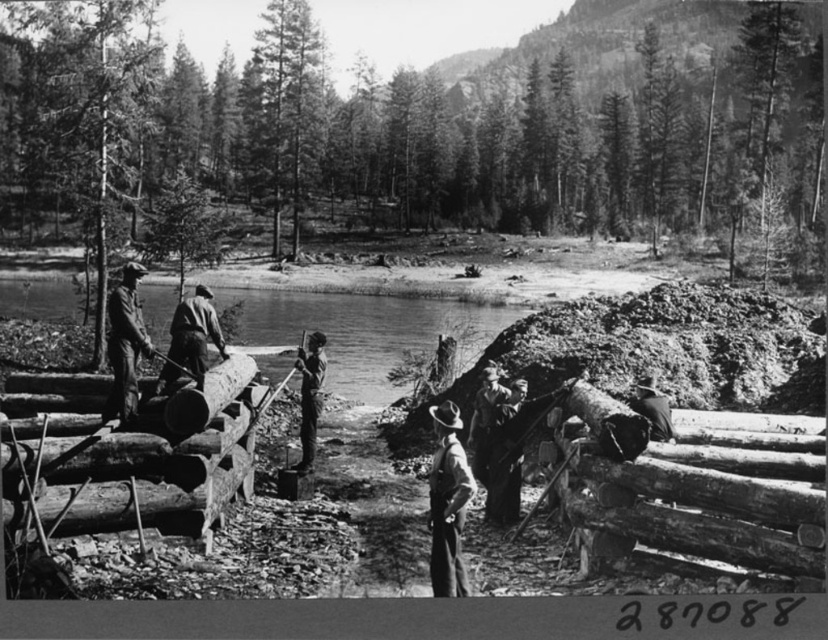
Question: Is smooth wood at center wider than matte black hat at left?

Choices:
 (A) no
 (B) yes

Answer: (B)

Question: Does smooth wood at center appear over matte black hat at left?

Choices:
 (A) no
 (B) yes

Answer: (A)

Question: Which point is farther to the camera?

Choices:
 (A) (95, 508)
 (B) (304, 435)
 (C) (95, 237)

Answer: (C)

Question: Is the position of smooth bark tree at center more distant than that of smooth leather hat at center?

Choices:
 (A) no
 (B) yes

Answer: (B)

Question: Which object appears closest to the camera in this image?

Choices:
 (A) clear water at center
 (B) smooth bark tree at left
 (C) smooth wood at center

Answer: (C)

Question: Which of the following is the farthest from the observer?

Choices:
 (A) smooth wood at center
 (B) smooth bark tree at left
 (C) smooth leather hat at center

Answer: (B)